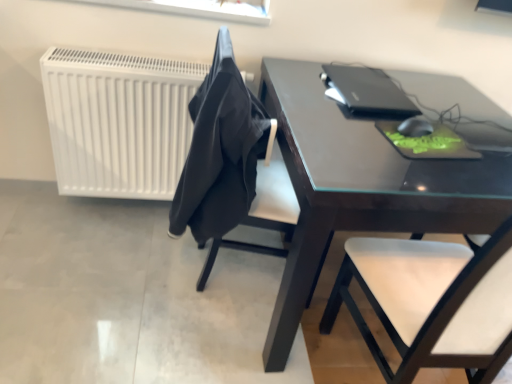
You are a GUI agent. You are given a task and a screenshot of the screen. Output one action in this format:
    pyautogui.click(x=<x>, y=<y>)
    Task: Click on the vacant space positioned to the left of black matte mouse at upper right
    The width and height of the screenshot is (512, 384).
    Given the screenshot: What is the action you would take?
    pyautogui.click(x=362, y=118)